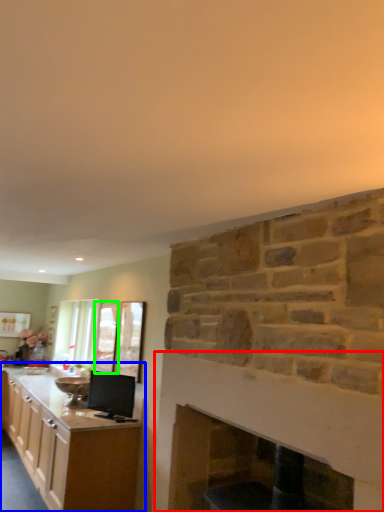
Question: Estimate the real-world distances between objects in this image. Which object is closer to fireplace (highlighted by a red box), cabinetry (highlighted by a blue box) or glass door (highlighted by a green box)?

Choices:
 (A) cabinetry
 (B) glass door

Answer: (A)